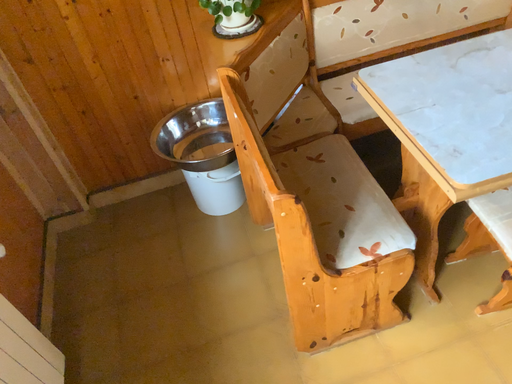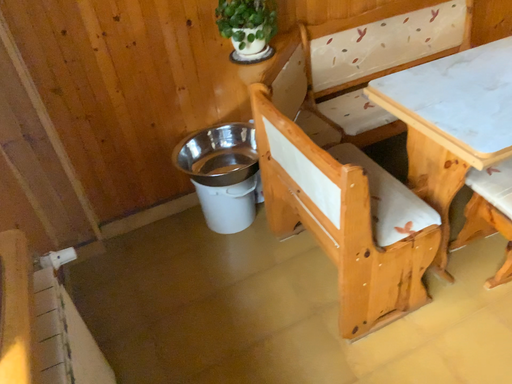
Question: How did the camera likely rotate when shooting the video?

Choices:
 (A) rotated left
 (B) rotated right

Answer: (B)